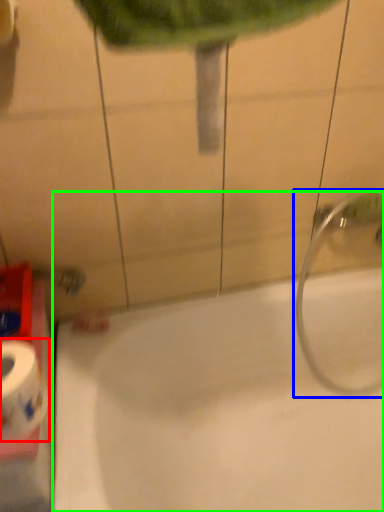
Question: Based on their relative distances, which object is farther from toilet paper (highlighted by a red box)? Choose from plumbing fixture (highlighted by a blue box) and bathtub (highlighted by a green box).

Choices:
 (A) plumbing fixture
 (B) bathtub

Answer: (A)